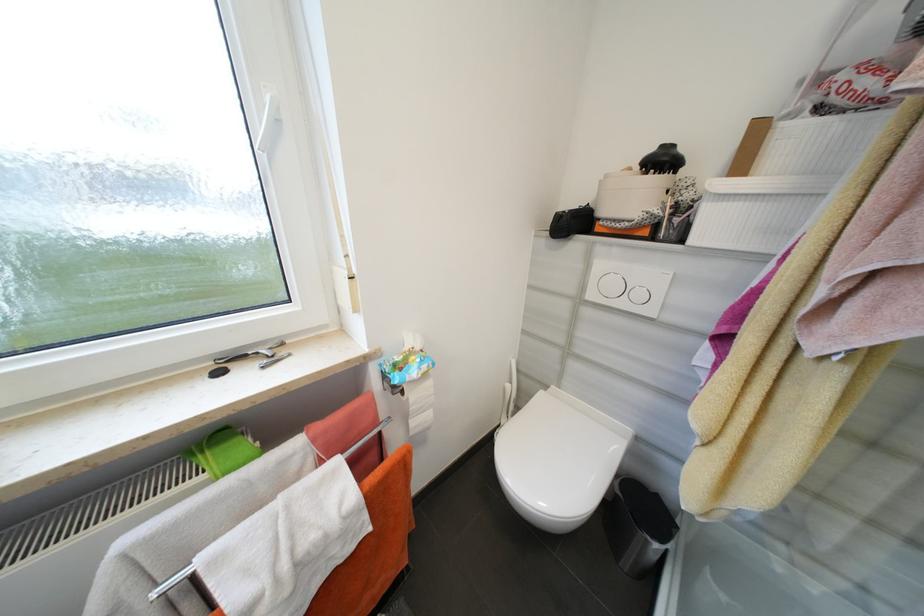
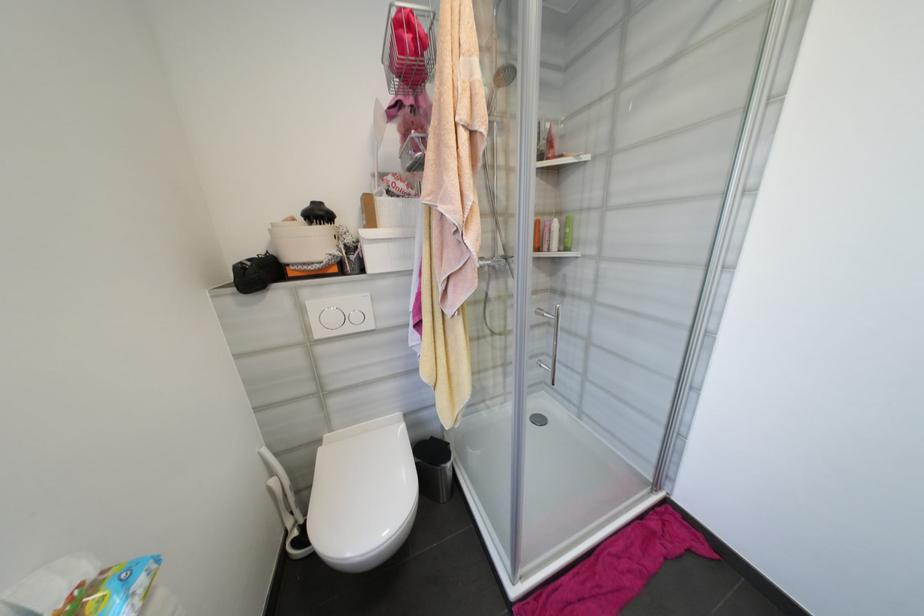
The point at (x=514, y=387) is marked in the first image. Where is the corresponding point in the second image?

(277, 482)